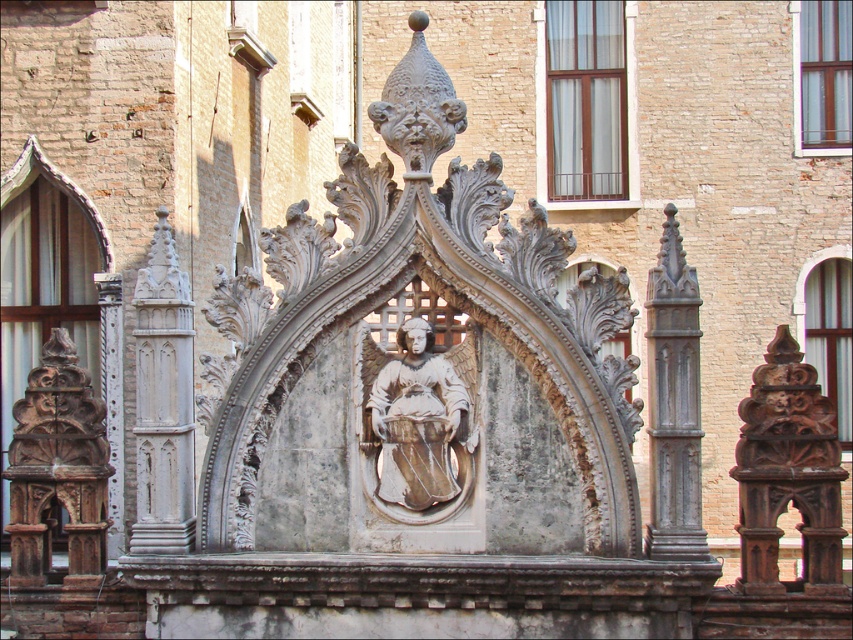
Question: Is white stone sculpture at center positioned in front of gray stone column at center?

Choices:
 (A) yes
 (B) no

Answer: (A)

Question: Which object is closer to the camera taking this photo?

Choices:
 (A) white stone sculpture at center
 (B) white stone angel at center

Answer: (A)

Question: Which of the following is the farthest from the observer?

Choices:
 (A) gray stone column at center
 (B) carved wood column at left
 (C) white stone column at left

Answer: (B)

Question: Among these points, which one is farthest from the camera?

Choices:
 (A) (471, 193)
 (B) (161, 236)

Answer: (B)

Question: Can you confirm if white stone sculpture at center is bigger than carved wood column at left?

Choices:
 (A) yes
 (B) no

Answer: (A)

Question: Can you confirm if white stone sculpture at center is positioned to the left of white stone angel at center?

Choices:
 (A) yes
 (B) no

Answer: (B)